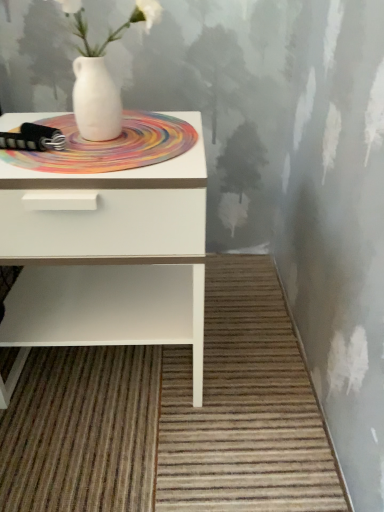
This screenshot has height=512, width=384. I want to click on vacant region to the right of white matte vase at upper center, so click(x=184, y=134).